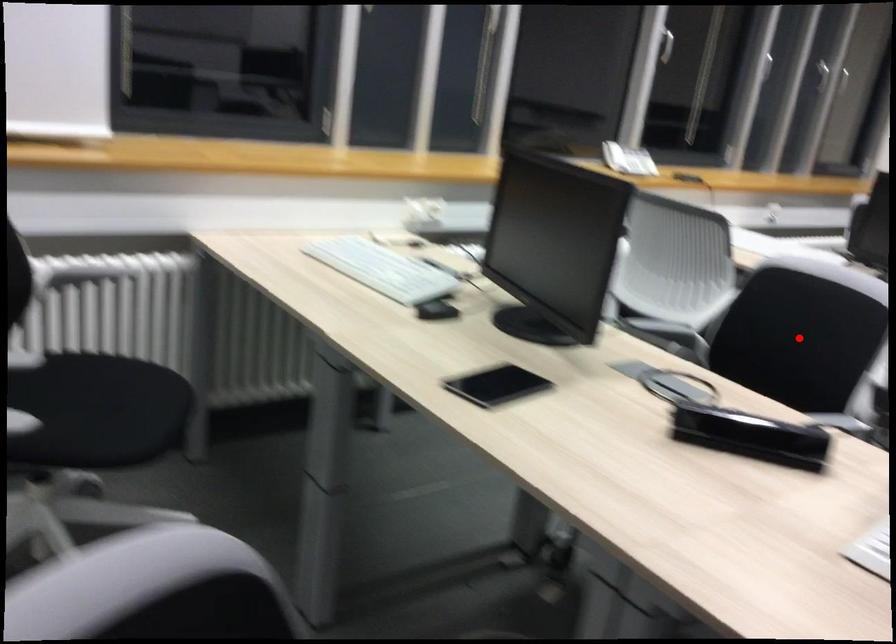
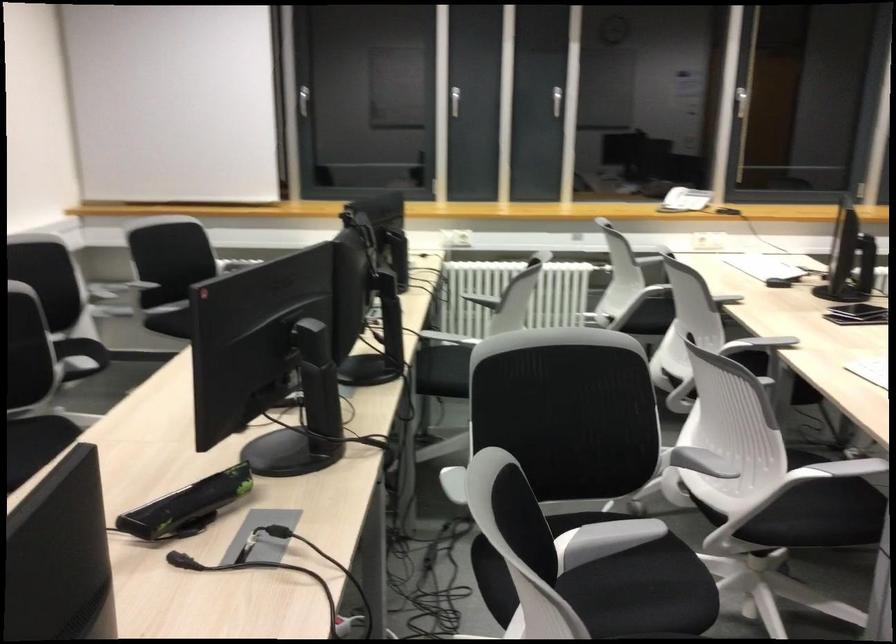
Question: I am providing you with two images of the same scene from different viewpoints. A red point is marked on the first image. At the location where the point appears in image 1, is it still visible in image 2?

Choices:
 (A) Yes
 (B) No

Answer: (B)